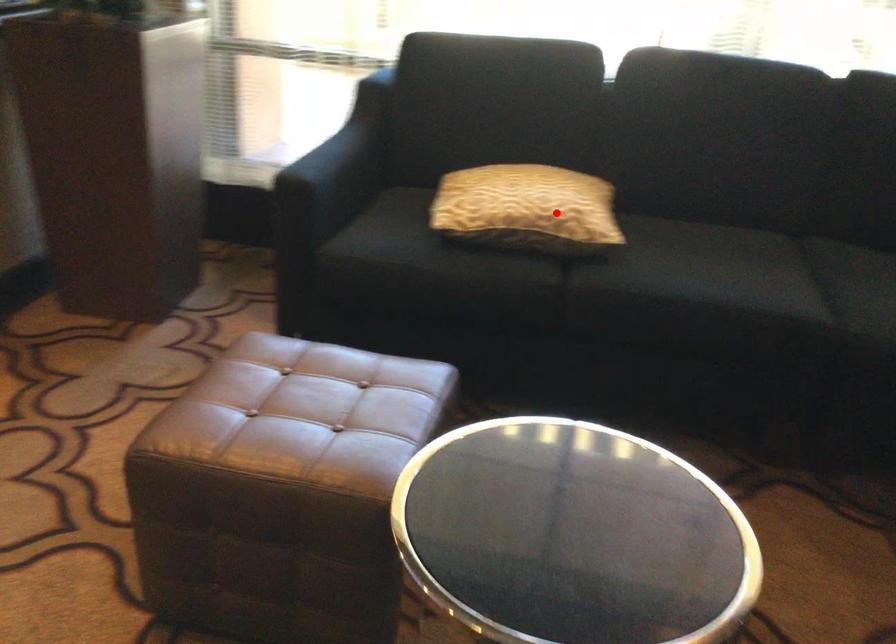
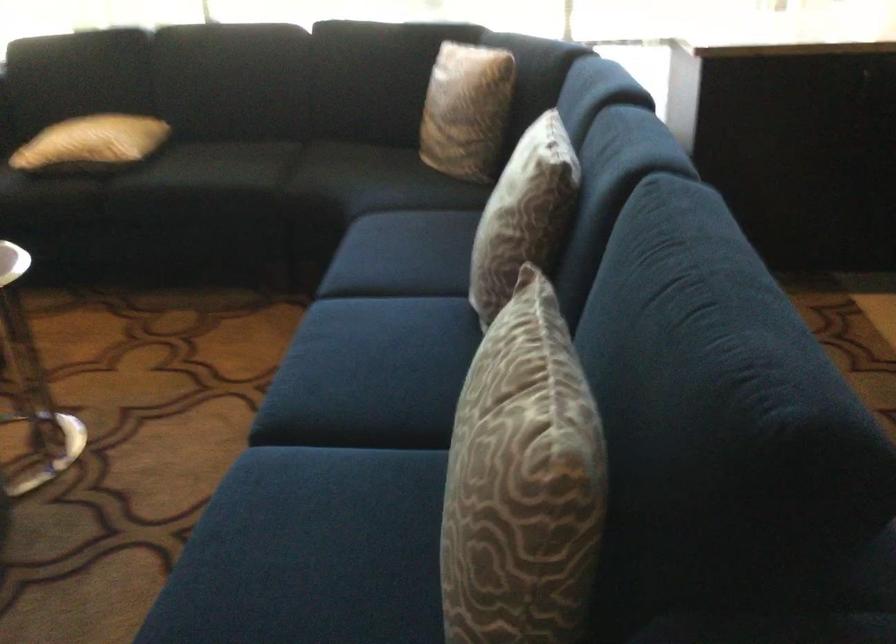
Question: I am providing you with two images of the same scene from different viewpoints. In image1, a red point is highlighted. Considering the same 3D point in image2, which of the following is correct?

Choices:
 (A) It is closer
 (B) It is farther

Answer: (B)